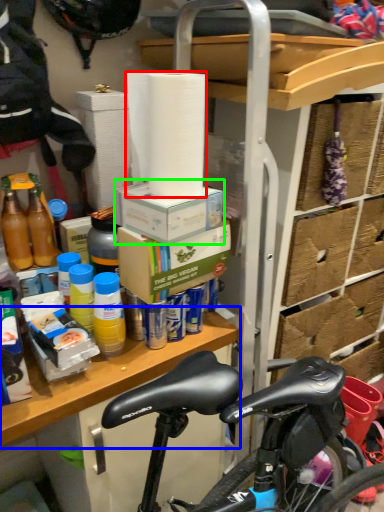
Question: Based on their relative distances, which object is nearer to paper towel (highlighted by a red box)? Choose from table (highlighted by a blue box) and box (highlighted by a green box).

Choices:
 (A) table
 (B) box

Answer: (B)